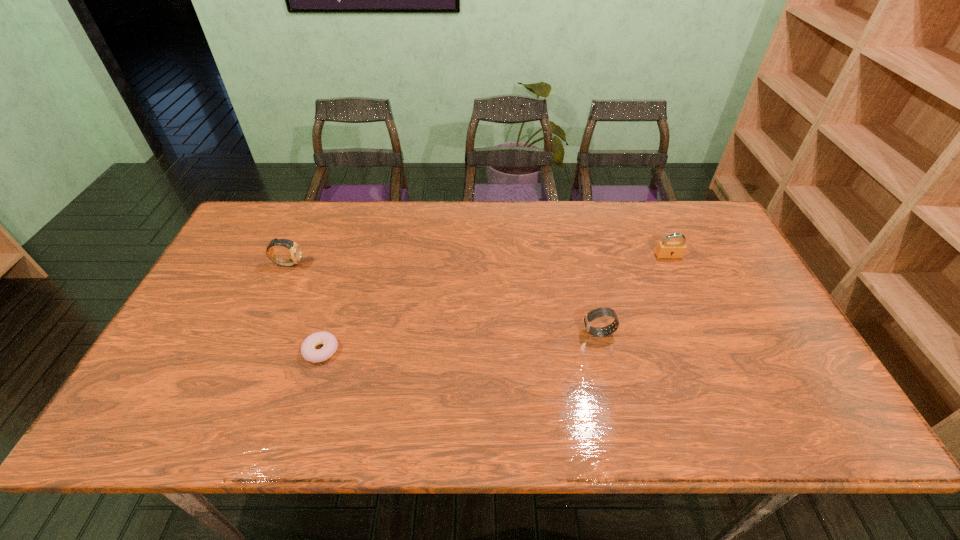
The image size is (960, 540). Identify the location of vacant position located 0.120m on the face of the third object from left to right. (537, 333).

You are a GUI agent. You are given a task and a screenshot of the screen. Output one action in this format:
    pyautogui.click(x=<x>, y=<y>)
    Task: Click on the vacant space located 0.050m on the face of the third object from left to right
    This screenshot has width=960, height=540.
    Given the screenshot: What is the action you would take?
    pyautogui.click(x=564, y=333)

At what (x,y) coordinates should I click in order to perform the action: click on blank space located on the right of the shortest object. Please return your answer as a coordinate pair (x, y). The image size is (960, 540). Looking at the image, I should click on 459,350.

The image size is (960, 540). Identify the location of object located at the left edge. (295, 249).

The width and height of the screenshot is (960, 540). In the image, there is a desktop. Identify the location of vacant space at the far edge. (559, 240).

In the image, there is a desktop. Identify the location of free region at the near edge. Image resolution: width=960 pixels, height=540 pixels. (267, 401).

The height and width of the screenshot is (540, 960). In order to click on blank area at the left edge in this screenshot , I will do `click(244, 319)`.

The height and width of the screenshot is (540, 960). In the image, there is a desktop. What are the coordinates of `vacant space at the right edge` in the screenshot? It's located at (691, 261).

In the image, there is a desktop. Identify the location of vacant space at the far right corner. (681, 206).

This screenshot has width=960, height=540. I want to click on vacant area between the padlock and the left watch, so click(478, 260).